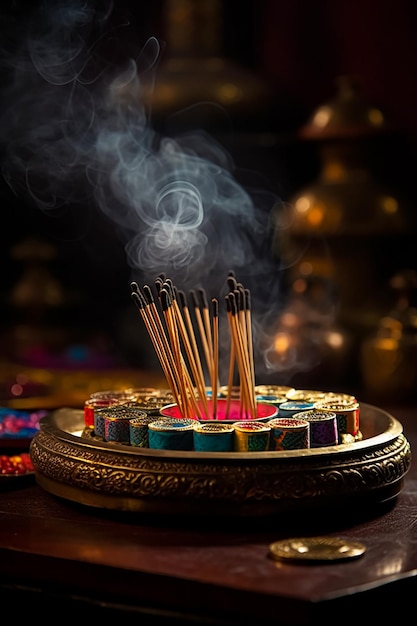
Where is `red object on the table`? red object on the table is located at coordinates (23, 464).